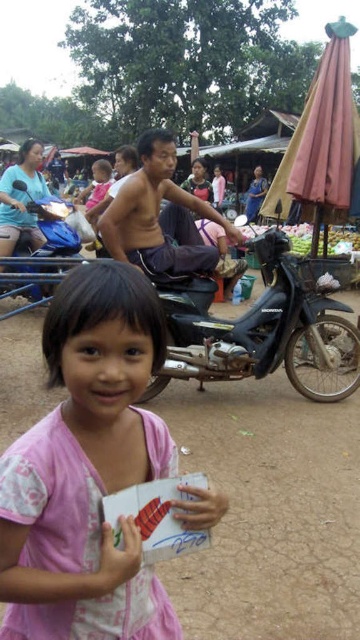
Question: Observing the image, what is the correct spatial positioning of shiny purple pants at center in reference to blue matte motorcycle at center?

Choices:
 (A) left
 (B) right

Answer: (B)

Question: Which point is closer to the camera?

Choices:
 (A) (165, 147)
 (B) (249, 346)

Answer: (A)

Question: Where is pink fabric child at center located in relation to blue matte motorcycle at center in the image?

Choices:
 (A) above
 (B) below

Answer: (B)

Question: Estimate the real-world distances between objects in this image. Which object is closer to the shiny purple pants at center?

Choices:
 (A) black matte motorcycle at center
 (B) blue matte motorcycle at center
 (C) pink fabric child at center

Answer: (A)

Question: Can you confirm if shiny purple pants at center is positioned to the right of blue matte motorcycle at center?

Choices:
 (A) no
 (B) yes

Answer: (B)

Question: Which object is positioned farthest from the black matte motorcycle at center?

Choices:
 (A) blue matte motorcycle at center
 (B) pink fabric child at center

Answer: (B)